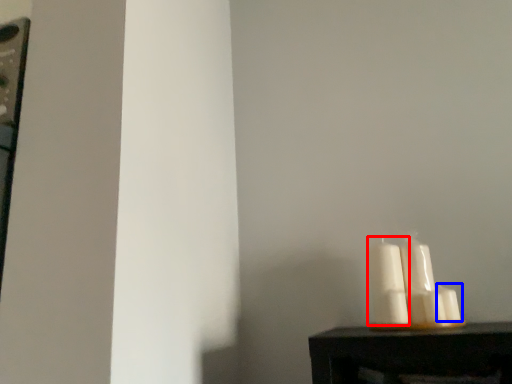
Question: Which point is further to the camera, candle (highlighted by a red box) or candle (highlighted by a blue box)?

Choices:
 (A) candle
 (B) candle

Answer: (A)